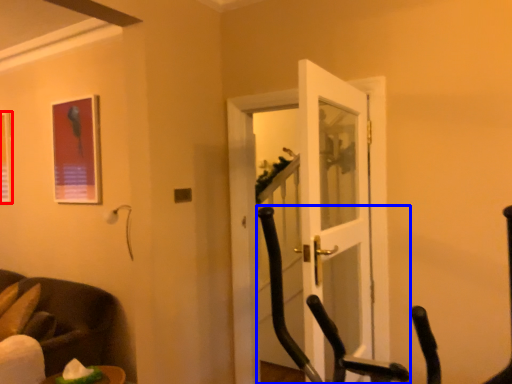
Question: Which of the following is the closest to the observer, picture frame (highlighted by a red box) or rocking chair (highlighted by a blue box)?

Choices:
 (A) picture frame
 (B) rocking chair

Answer: (B)